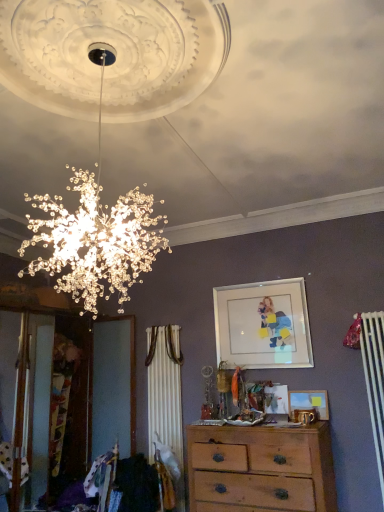
Question: From the image's perspective, is wooden chest of drawers at center located beneath matte glass picture frame at upper center, which is the second picture frame from bottom to top?

Choices:
 (A) no
 (B) yes

Answer: (B)

Question: Is wooden chest of drawers at center shorter than matte glass picture frame at upper center, which is the first picture frame from top to bottom?

Choices:
 (A) no
 (B) yes

Answer: (B)

Question: Is wooden chest of drawers at center oriented towards matte glass picture frame at upper center, which is the second picture frame from bottom to top?

Choices:
 (A) yes
 (B) no

Answer: (B)

Question: Considering the relative sizes of wooden chest of drawers at center and matte glass picture frame at upper center, which is the second picture frame from bottom to top, in the image provided, is wooden chest of drawers at center smaller than matte glass picture frame at upper center, which is the second picture frame from bottom to top,?

Choices:
 (A) yes
 (B) no

Answer: (B)

Question: From the image's perspective, is wooden chest of drawers at center above matte glass picture frame at upper center, which is the first picture frame from top to bottom?

Choices:
 (A) yes
 (B) no

Answer: (B)

Question: Is point (271, 366) positioned closer to the camera than point (309, 431)?

Choices:
 (A) closer
 (B) farther

Answer: (B)

Question: Is matte glass picture frame at upper center, which is the second picture frame from bottom to top, inside the boundaries of wooden chest of drawers at center, or outside?

Choices:
 (A) outside
 (B) inside

Answer: (A)

Question: From a real-world perspective, is matte glass picture frame at upper center, which is the first picture frame from top to bottom, above or below wooden chest of drawers at center?

Choices:
 (A) below
 (B) above

Answer: (B)

Question: Based on their positions, is matte glass picture frame at upper center, which is the first picture frame from top to bottom, located to the left or right of wooden chest of drawers at center?

Choices:
 (A) right
 (B) left

Answer: (A)

Question: From the image's perspective, relative to matte glass picture frame at upper center, which is the second picture frame from bottom to top, is matte wooden picture frame at center, acting as the 2th picture frame starting from the top, above or below?

Choices:
 (A) above
 (B) below

Answer: (B)

Question: Considering their positions, is matte wooden picture frame at center, placed as the first picture frame when sorted from bottom to top, located in front of or behind matte glass picture frame at upper center, which is the second picture frame from bottom to top?

Choices:
 (A) front
 (B) behind

Answer: (A)

Question: Which is correct: matte wooden picture frame at center, acting as the 2th picture frame starting from the top, is inside matte glass picture frame at upper center, which is the first picture frame from top to bottom, or outside of it?

Choices:
 (A) outside
 (B) inside

Answer: (A)

Question: Considering the positions of matte wooden picture frame at center, acting as the 2th picture frame starting from the top, and matte glass picture frame at upper center, which is the first picture frame from top to bottom, in the image, is matte wooden picture frame at center, acting as the 2th picture frame starting from the top, wider or thinner than matte glass picture frame at upper center, which is the first picture frame from top to bottom,?

Choices:
 (A) thin
 (B) wide

Answer: (B)

Question: In terms of size, does wooden chest of drawers at center appear bigger or smaller than matte glass picture frame at upper center, which is the first picture frame from top to bottom?

Choices:
 (A) small
 (B) big

Answer: (B)

Question: In terms of height, does wooden chest of drawers at center look taller or shorter compared to matte glass picture frame at upper center, which is the second picture frame from bottom to top?

Choices:
 (A) short
 (B) tall

Answer: (A)